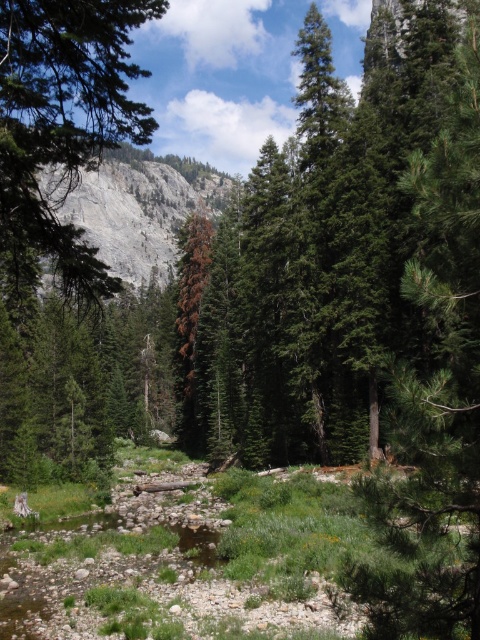
You are a hiker planning to cross the stream in the scene. You need to place markers between the green textured pine tree at right and the green textured tree at center to indicate safe crossing points. Given the distance between them is 90.93 feet, how many markers should you place if each marker is spaced 15 feet apart?

The distance between the green textured pine tree at right and the green textured tree at center is 90.93 feet. Dividing this distance by the spacing of 15 feet per marker gives approximately 6 markers. However, since you need markers at both starting and ending points, you would need 7 markers in total.

You are an outdoor enthusiast planning to hike through the forest. You notice the green textured pine tree at right and the gray rock formation at upper left. Which of these two landmarks is closer to your current position?

The green textured pine tree at right is closer to your current position because it is smaller in size compared to the gray rock formation at upper left.

You are an outdoor enthusiast planning a hiking route through the forest. You need to decide whether to go around the green textured pine tree at right or the gray rock formation at upper left first. Based on their positions, which one should you encounter first?

The green textured pine tree at right is below the gray rock formation at upper left, so you will encounter the green textured pine tree at right first as it is closer to the lower part of the scene.